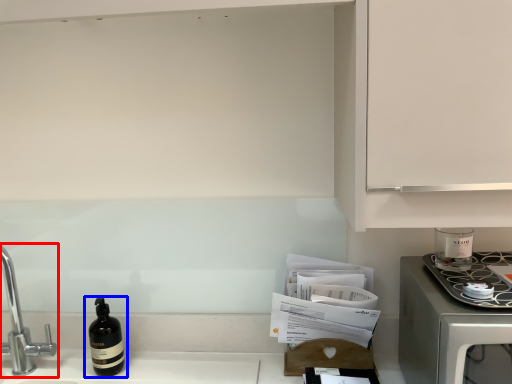
Question: Which point is closer to the camera, tap (highlighted by a red box) or bottle (highlighted by a blue box)?

Choices:
 (A) tap
 (B) bottle

Answer: (A)